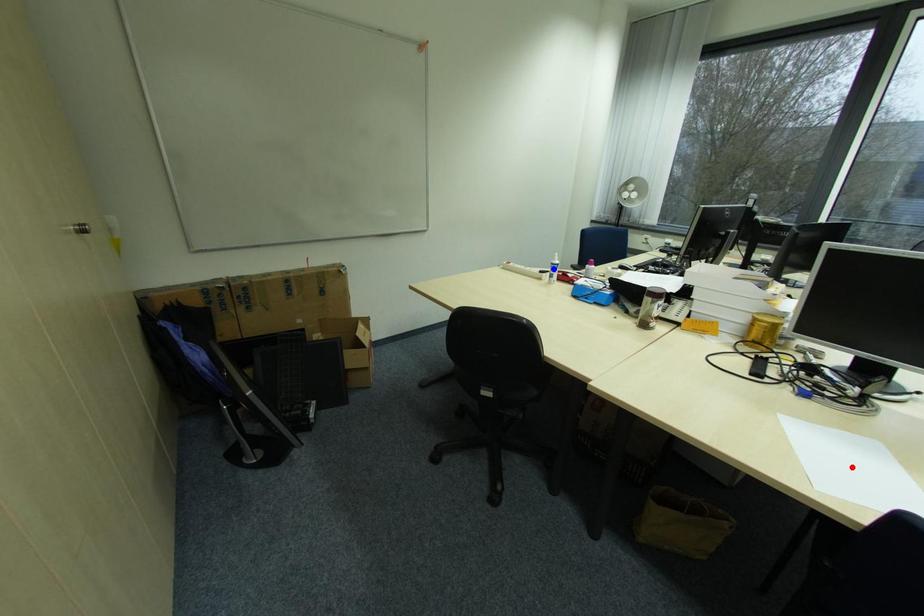
Question: In the image, two points are highlighted. Which point is nearer to the camera? Reply with the corresponding letter.

Choices:
 (A) blue point
 (B) red point

Answer: (B)